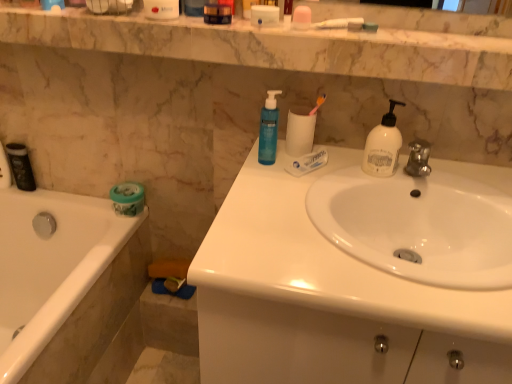
The height and width of the screenshot is (384, 512). I want to click on empty space that is ontop of marble at upper center (from a real-world perspective), so pyautogui.click(x=255, y=26).